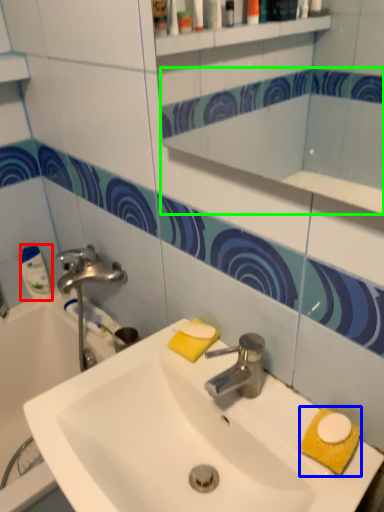
Question: Estimate the real-world distances between objects in this image. Which object is closer to cleaning product (highlighted by a red box), hand towel (highlighted by a blue box) or mirror (highlighted by a green box)?

Choices:
 (A) hand towel
 (B) mirror

Answer: (A)